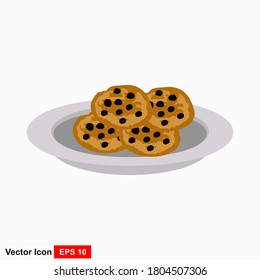
Locate an element on the screen. The height and width of the screenshot is (280, 260). plate is located at coordinates (98, 166).